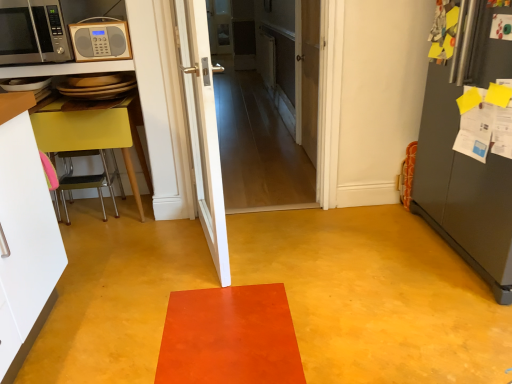
This screenshot has height=384, width=512. I want to click on free spot to the right of white glossy door at center, acting as the third door starting from the back, so click(282, 256).